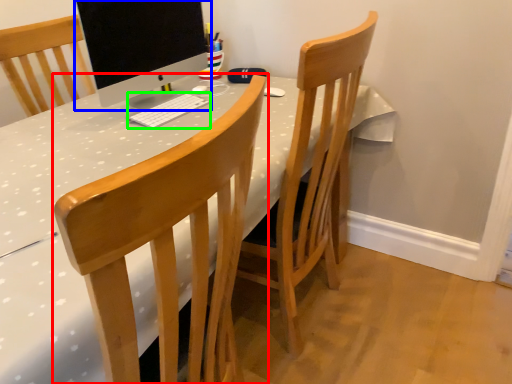
Question: Which object is positioned closest to chair (highlighted by a red box)? Select from computer monitor (highlighted by a blue box) and computer keyboard (highlighted by a green box).

Choices:
 (A) computer monitor
 (B) computer keyboard

Answer: (B)